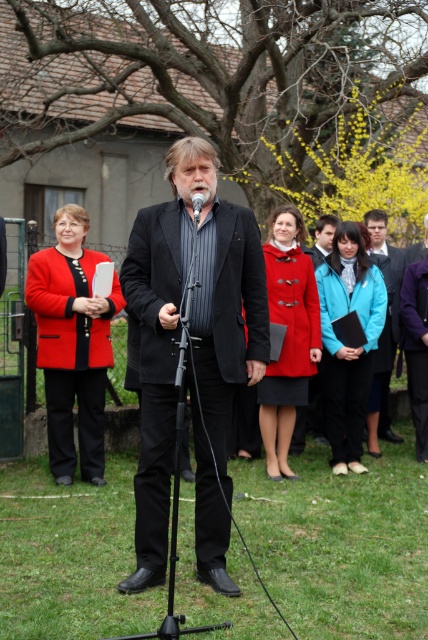
You are an event organizer who needs to arrange seating for attendees. You see the matte red coat at left and the blue fabric jacket at center. Which attendee is seated farther to the left side of the stage?

The matte red coat at left is seated farther to the left side of the stage because it is positioned on the left side of the blue fabric jacket at center.